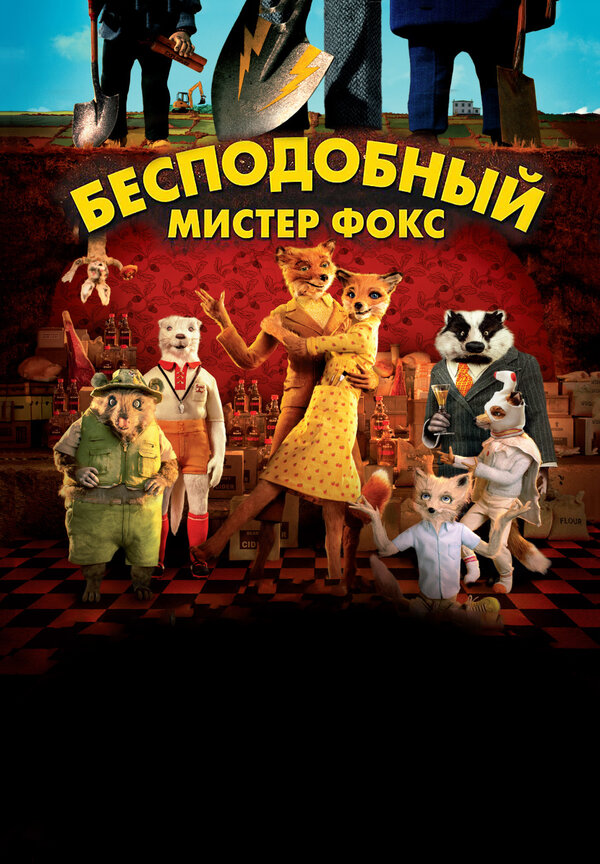
Where is `black and white checked floor`? black and white checked floor is located at coordinates (73, 593).